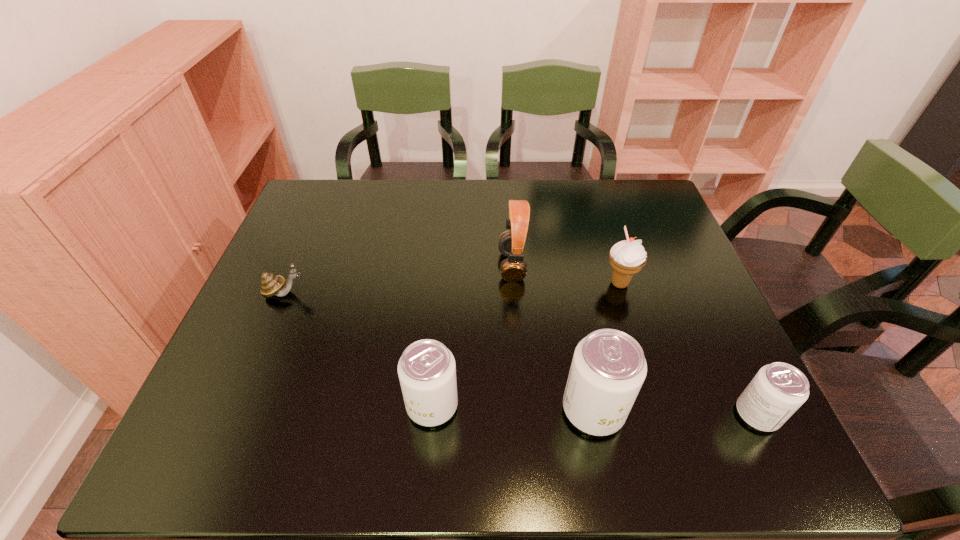
The height and width of the screenshot is (540, 960). Find the location of `free location located on the back of the fourth object from left to right`. free location located on the back of the fourth object from left to right is located at coordinates (567, 276).

Locate an element on the screen. This screenshot has width=960, height=540. free space located 0.330m on the back of the rightmost object is located at coordinates (694, 282).

You are a GUI agent. You are given a task and a screenshot of the screen. Output one action in this format:
    pyautogui.click(x=<x>, y=<y>)
    Task: Click on the free space located 0.360m on the ear cups of the headset
    This screenshot has height=540, width=960.
    Given the screenshot: What is the action you would take?
    pyautogui.click(x=365, y=266)

Identify the location of vacant space located on the ear cups of the headset. This screenshot has height=540, width=960. (424, 266).

What are the coordinates of `vacant area situated on the ear cups of the headset` in the screenshot? It's located at (462, 266).

Identify the location of free point located on the face of the snail. (421, 293).

I want to click on vacant area located on the back of the icecream, so [x=612, y=259].

Identify the location of object that is at the left edge. The image size is (960, 540). (271, 285).

Where is `soda can that is at the right edge`? This screenshot has width=960, height=540. soda can that is at the right edge is located at coordinates click(x=777, y=391).

The image size is (960, 540). I want to click on icecream that is at the right edge, so pos(627,257).